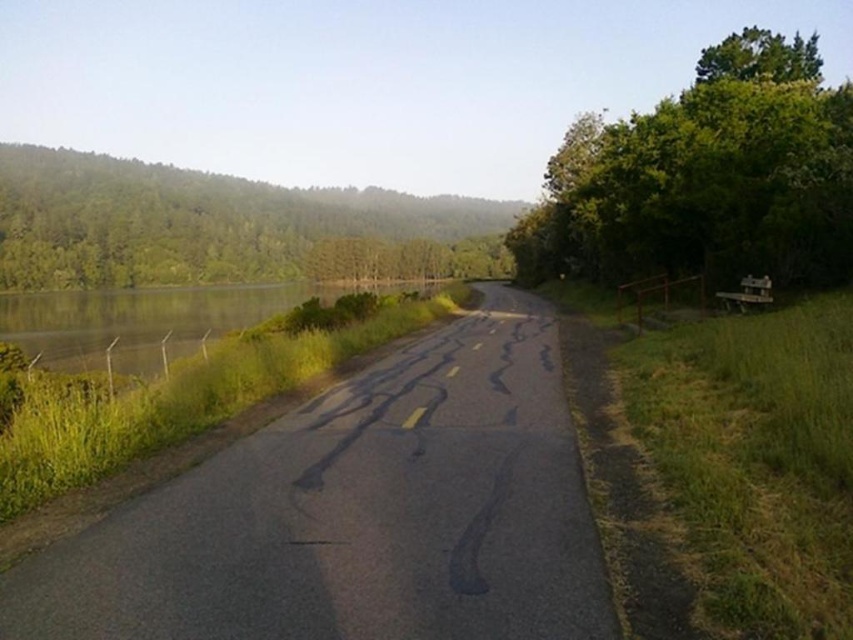
You are driving a car that is 2 meters wide. You need to cross the asphalt road at left while avoiding the green grassy water at left. Is there enough space for your car to safely pass through the road without getting too close to the water?

The asphalt road at left is thinner than green grassy water at left. Since the road is narrower than the water area, it might not provide enough width for a 2m wide car to safely pass without getting too close to the water. Consider taking an alternative route for safety.

Consider the image. You are a hiker standing on the road and want to take a photo of both the green leafy trees at upper left and the green grassy water at left. Which object should you focus on first to ensure both are in the frame?

You should focus on the green leafy trees at upper left first because it is closer to you than the green grassy water at left, ensuring both are in the frame.